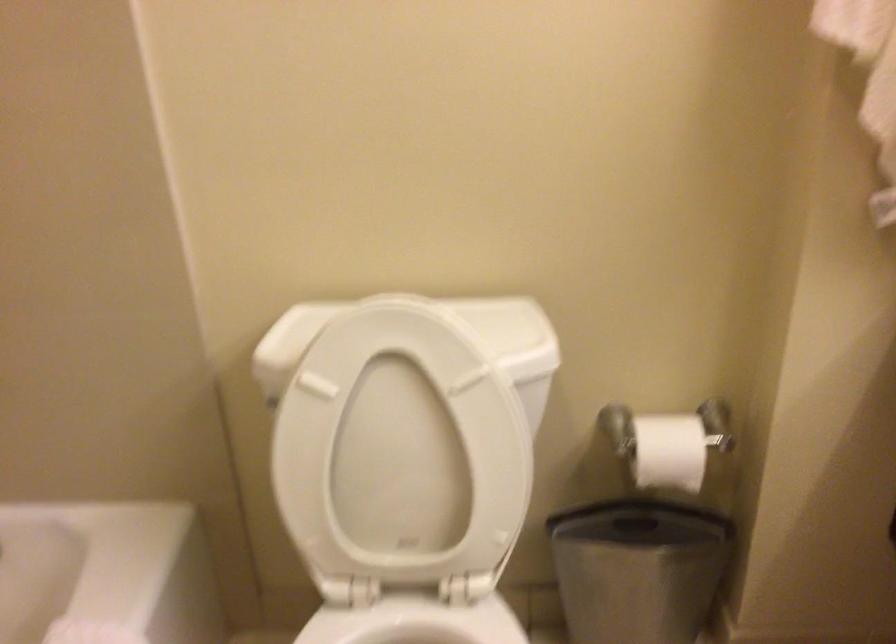
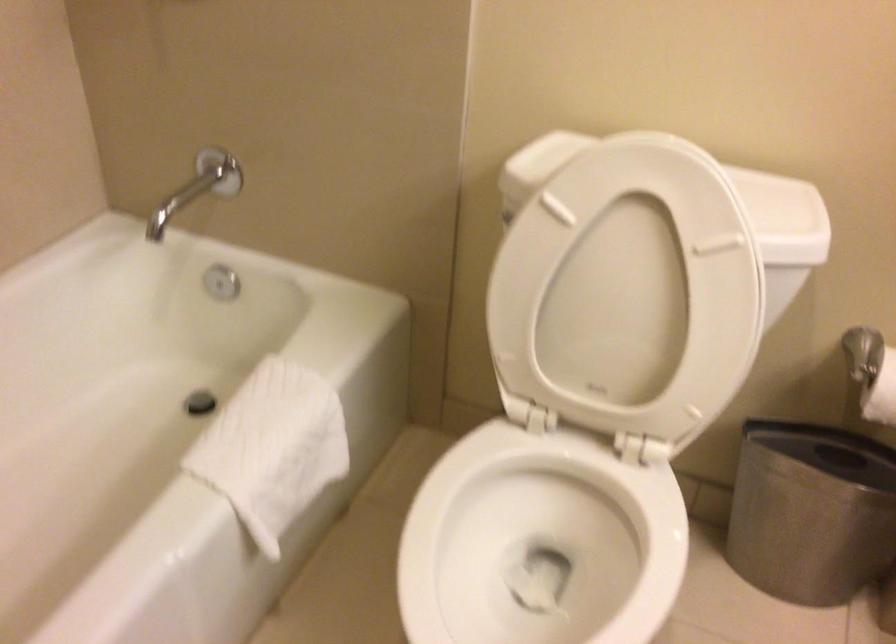
In the second image, find the point that corresponds to [647,462] in the first image.

(881, 393)